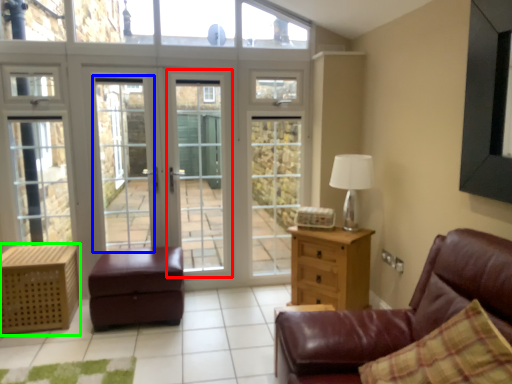
Question: Estimate the real-world distances between objects in this image. Which object is closer to screen door (highlighted by a red box), screen door (highlighted by a blue box) or nightstand (highlighted by a green box)?

Choices:
 (A) screen door
 (B) nightstand

Answer: (A)